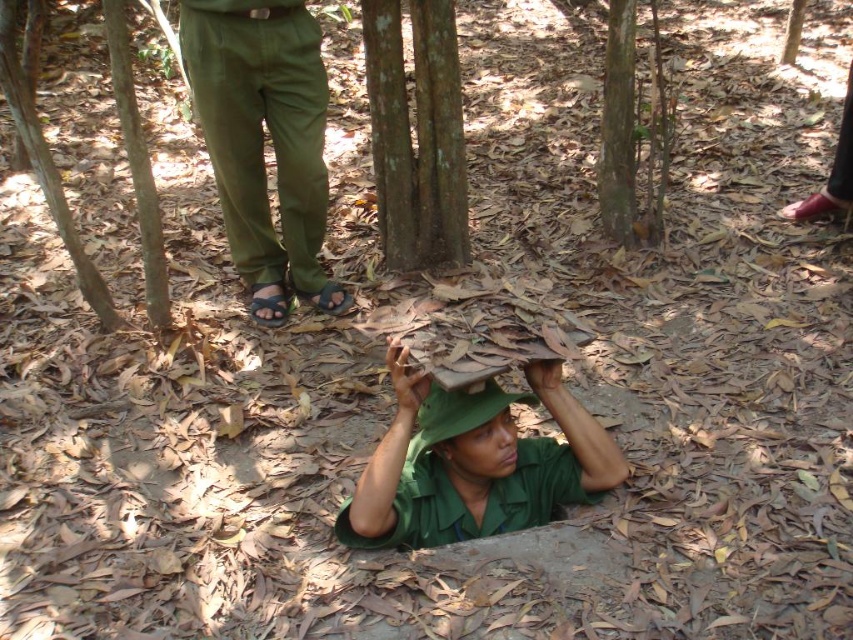
Between point (625, 65) and point (144, 156), which one is positioned behind?

The point (625, 65) is more distant.

In the scene shown: Between smooth brown bark at center and brown rough tree at center, which one appears on the left side from the viewer's perspective?

Positioned to the left is brown rough tree at center.

Where is `smooth brown bark at center`? smooth brown bark at center is located at coordinates (618, 125).

In the scene shown: Between green matte uniform at center and smooth brown tree trunk at center, which one is positioned higher?

smooth brown tree trunk at center is higher up.

Who is more distant from viewer, (561, 493) or (802, 19)?

The point (802, 19) is behind.

This screenshot has width=853, height=640. Describe the element at coordinates (473, 464) in the screenshot. I see `green matte uniform at center` at that location.

Find the location of `green matte uniform at center`. green matte uniform at center is located at coordinates (473, 464).

Does green fabric hat at center have a smaller size compared to brown fabric sandal at lower center?

Incorrect, green fabric hat at center is not smaller in size than brown fabric sandal at lower center.

Is green fabric hat at center closer to camera compared to brown fabric sandal at lower center?

That is True.

What do you see at coordinates (459, 412) in the screenshot?
I see `green fabric hat at center` at bounding box center [459, 412].

Find the location of a particular element. This screenshot has width=853, height=640. green fabric hat at center is located at coordinates (459, 412).